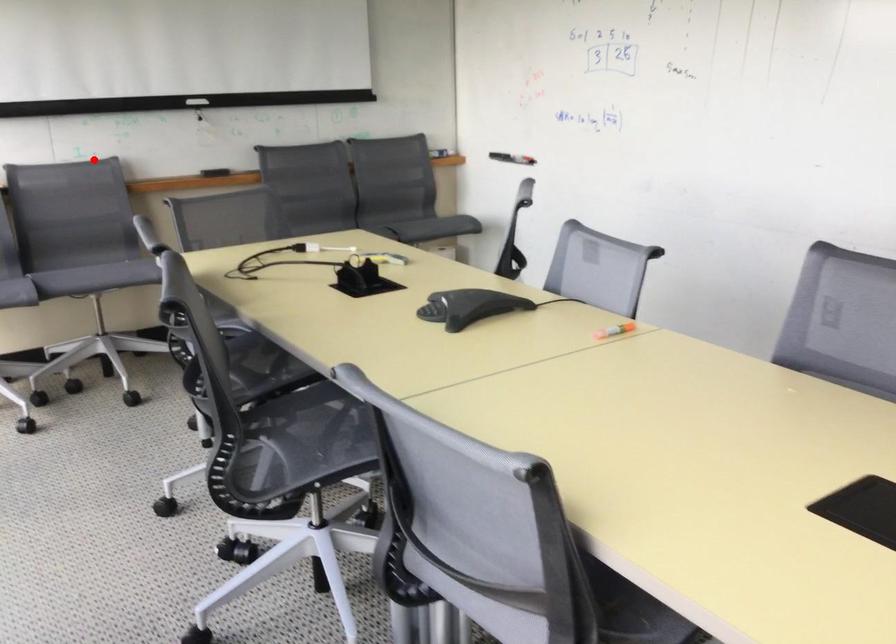
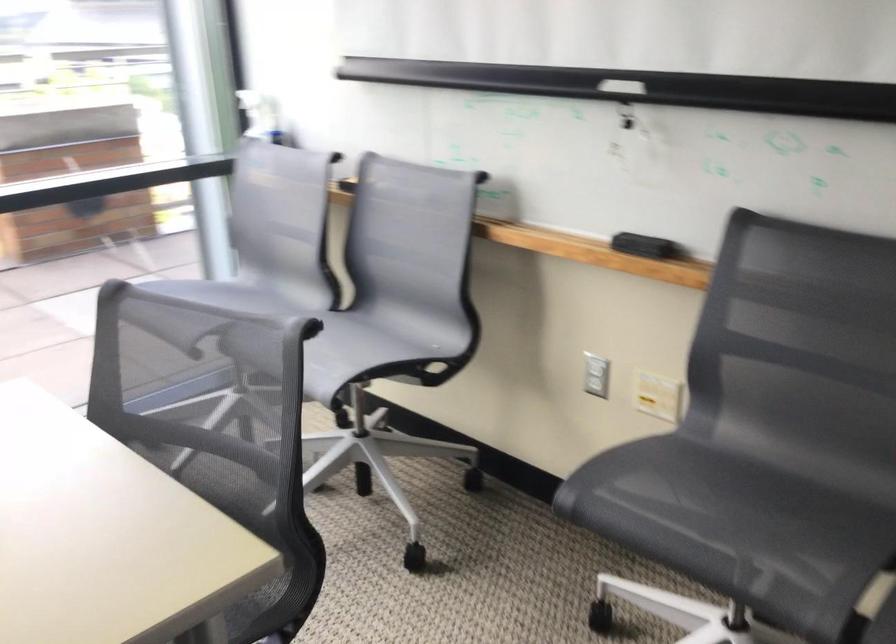
Question: A red point is marked in image1. In image2, is the corresponding 3D point closer to the camera or farther? Reply with the corresponding letter.

Choices:
 (A) The corresponding 3D point is closer.
 (B) The corresponding 3D point is farther.

Answer: (A)